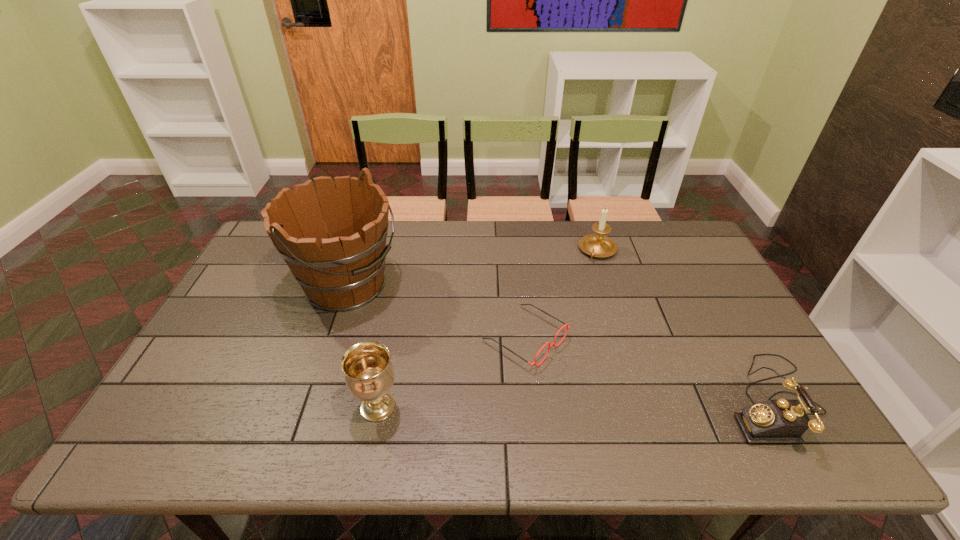
Where is `free region at the near left corner of the desktop`? This screenshot has width=960, height=540. free region at the near left corner of the desktop is located at coordinates (223, 413).

In the image, there is a desktop. Where is `vacant space at the far right corner`? vacant space at the far right corner is located at coordinates (677, 260).

In order to click on unoccupied position between the rightmost object and the shortest object in this screenshot , I will do `click(648, 369)`.

Identify the location of vacant region between the third object from right to left and the candle holder. (562, 294).

Find the location of a particular element. vacant area that lies between the second shortest object and the second object from right to left is located at coordinates (684, 326).

The image size is (960, 540). Identify the location of free space between the chalice and the fourth tallest object. (575, 404).

You are a GUI agent. You are given a task and a screenshot of the screen. Output one action in this format:
    pyautogui.click(x=<x>, y=<y>)
    Task: Click on the free space that is in between the shortest object and the wine bucket
    Image resolution: width=960 pixels, height=540 pixels.
    Given the screenshot: What is the action you would take?
    pyautogui.click(x=436, y=313)

At what (x,y) coordinates should I click in order to perform the action: click on free point between the tallest object and the third object from left to right. Please return your answer as a coordinate pair (x, y). The height and width of the screenshot is (540, 960). Looking at the image, I should click on [436, 313].

This screenshot has width=960, height=540. Identify the location of vacant point located between the tallest object and the candle holder. (472, 269).

The width and height of the screenshot is (960, 540). Identify the location of free space between the candle holder and the tallest object. (472, 269).